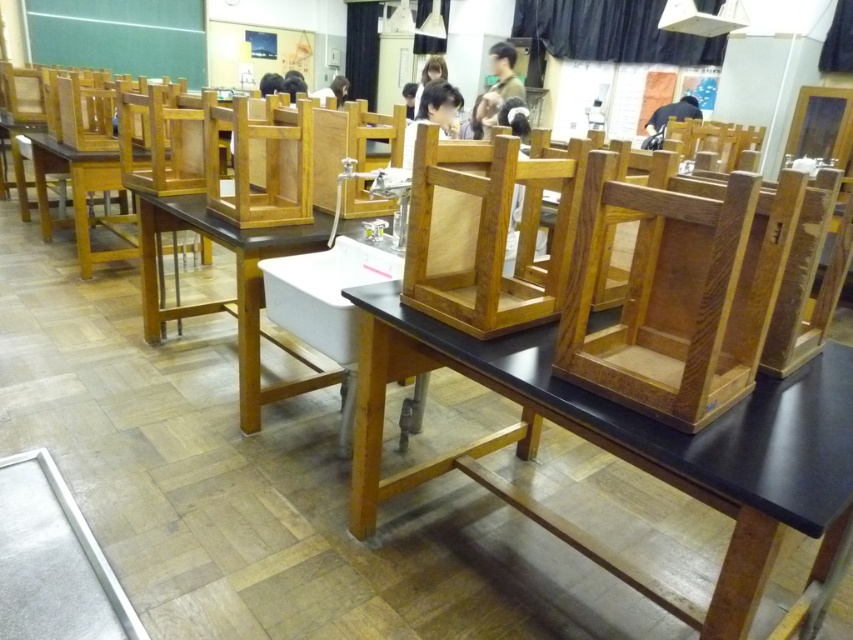
Question: Is dark brown wooden chair at upper center behind white matte shirt at upper center?

Choices:
 (A) yes
 (B) no

Answer: (B)

Question: Does wooden frame at center appear over dark brown hair at upper center?

Choices:
 (A) no
 (B) yes

Answer: (A)

Question: Considering the real-world distances, which object is closest to the wooden chair at center?

Choices:
 (A) dark brown wooden chair at upper center
 (B) wooden frame at center
 (C) black matte hair at upper center

Answer: (B)

Question: Estimate the real-world distances between objects in this image. Which object is farther from the wooden frame at center?

Choices:
 (A) wooden table at center
 (B) black matte hair at upper center
 (C) dark brown wooden chair at upper center

Answer: (C)

Question: Is dark brown wooden chair at upper center positioned at the back of white matte shirt at upper center?

Choices:
 (A) no
 (B) yes

Answer: (A)

Question: Which point is farther to the camera?

Choices:
 (A) (734, 236)
 (B) (262, 88)
 (C) (318, 380)
 (D) (437, 54)

Answer: (D)